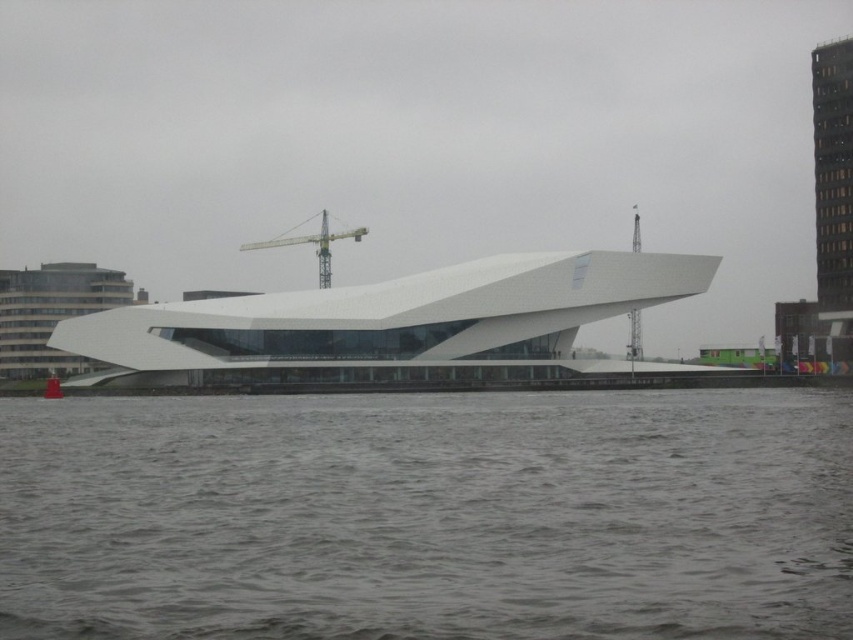
Question: Does gray water at lower center have a smaller size compared to yellow metallic crane at center?

Choices:
 (A) yes
 (B) no

Answer: (A)

Question: Is gray water at lower center to the left of yellow metallic crane at center from the viewer's perspective?

Choices:
 (A) no
 (B) yes

Answer: (A)

Question: Among these points, which one is farthest from the camera?

Choices:
 (A) (329, 237)
 (B) (622, 465)

Answer: (A)

Question: Among these objects, which one is nearest to the camera?

Choices:
 (A) yellow metallic crane at center
 (B) gray water at lower center

Answer: (B)

Question: Considering the relative positions of gray water at lower center and yellow metallic crane at center in the image provided, where is gray water at lower center located with respect to yellow metallic crane at center?

Choices:
 (A) below
 (B) above

Answer: (A)